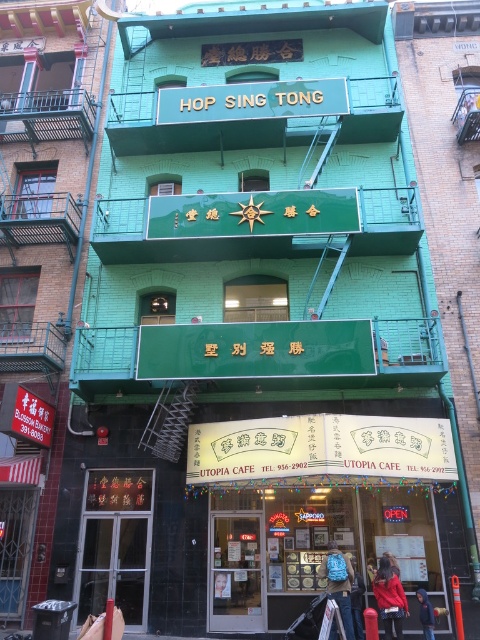
You are a customer at the Utopia Cafe and want to place your items on the teal facade near the entrance. The blue fabric bag at center and dark blue hoodie at lower right are both with you. Which item will take up more space horizontally when placed there?

The blue fabric bag at center has a larger width than the dark blue hoodie at lower right, so it will take up more horizontal space.

You are a customer at the Utopia Cafe and need to reach the entrance. You are currently standing near the blue fabric bag at center and the red fabric coat at lower right. Which object is closer to the cafe entrance?

The red fabric coat at lower right is closer to the cafe entrance because it is located at lower right, which is near the entrance area, while the blue fabric bag at center is further away.

You are standing at the entrance of the cafe and want to take a photo of the Hop Sing Tong signboard. Since the building is large, you need to step back to frame it properly. Based on the building location coordinates, how far to the right should you position yourself relative to the cafe entrance to capture the green matte building at center in your shot?

The green matte building at center is located at coordinates point (39, 262). Since the cafe entrance is at the lower part of the image, you should position yourself slightly to the right of the entrance to ensure the building is centered in your photo.